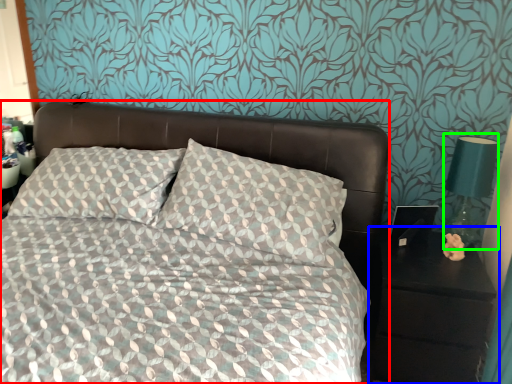
Question: Based on their relative distances, which object is farther from bed (highlighted by a red box)? Choose from nightstand (highlighted by a blue box) and bedside lamp (highlighted by a green box).

Choices:
 (A) nightstand
 (B) bedside lamp

Answer: (B)